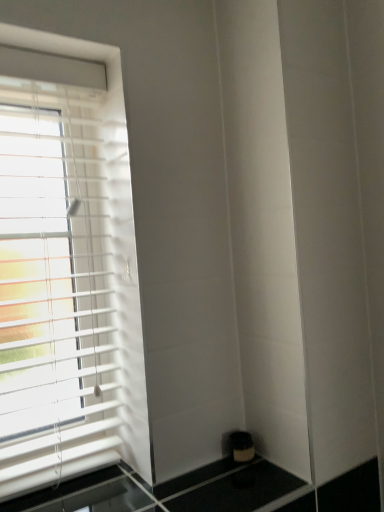
Question: Should I look upward or downward to see white plastic blinds at left?

Choices:
 (A) up
 (B) down

Answer: (B)